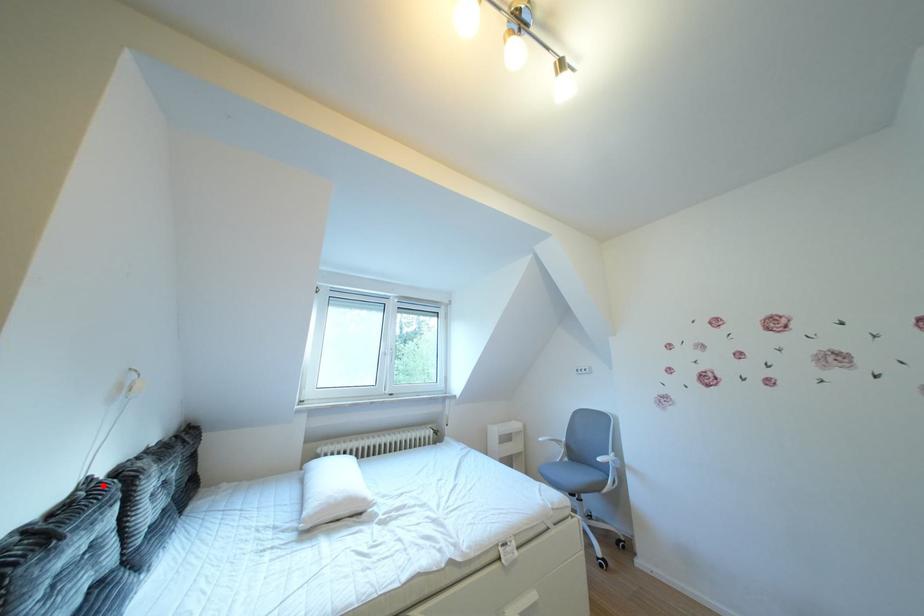
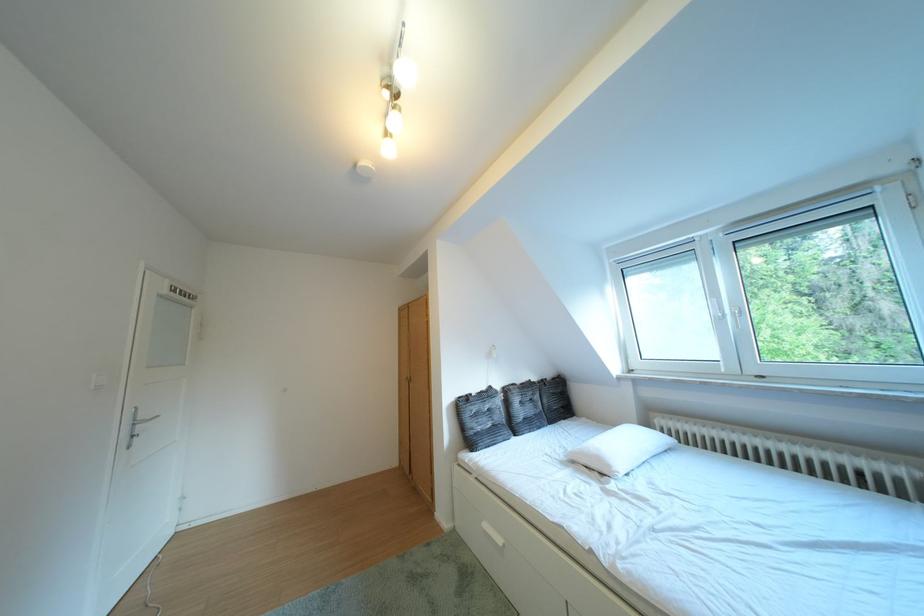
In the second image, find the point that corresponds to the highlighted location in the first image.

(504, 392)